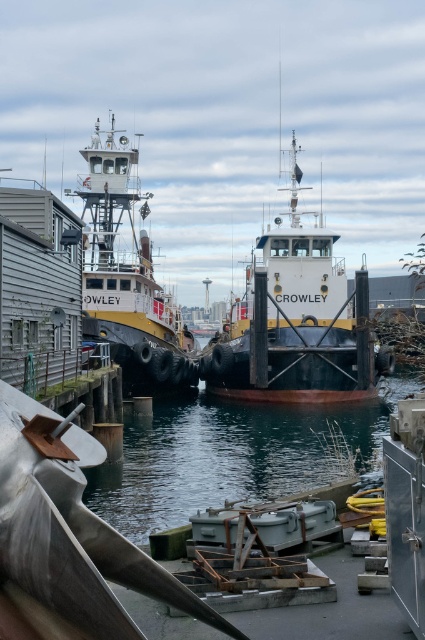
Can you confirm if clear water at center is thinner than yellow matte tugboat at left?

In fact, clear water at center might be wider than yellow matte tugboat at left.

Does point (282, 493) come closer to viewer compared to point (147, 348)?

Yes.

The height and width of the screenshot is (640, 425). Identify the location of clear water at center. (232, 456).

Locate an element on the screen. Image resolution: width=425 pixels, height=640 pixels. clear water at center is located at coordinates (232, 456).